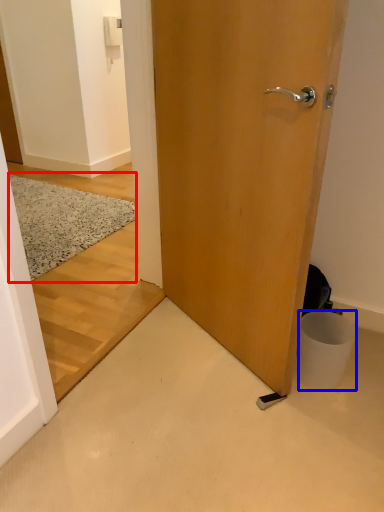
Question: Among these objects, which one is nearest to the camera, doormat (highlighted by a red box) or trash bin/can (highlighted by a blue box)?

Choices:
 (A) doormat
 (B) trash bin/can

Answer: (B)